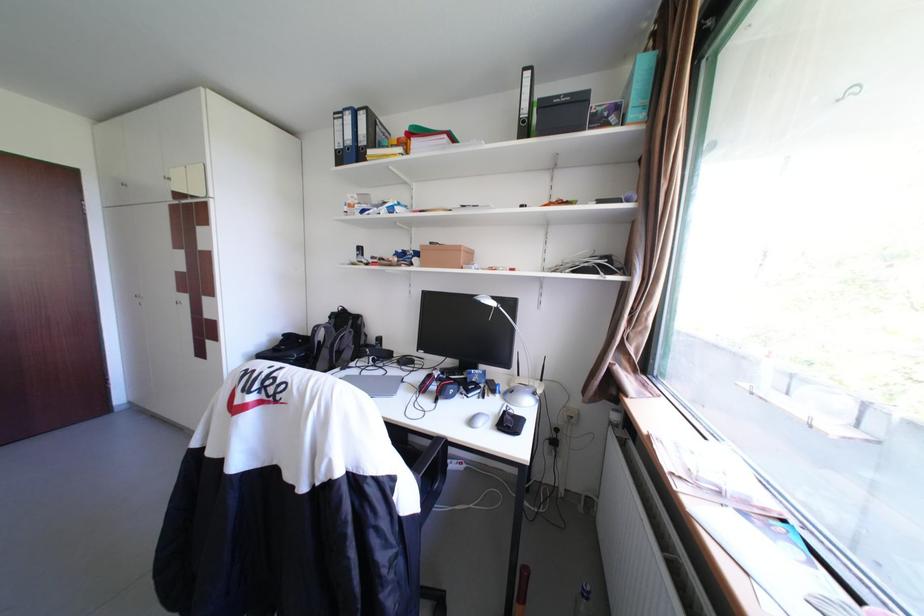
The height and width of the screenshot is (616, 924). What do you see at coordinates (478, 419) in the screenshot? I see `the white computer mouse` at bounding box center [478, 419].